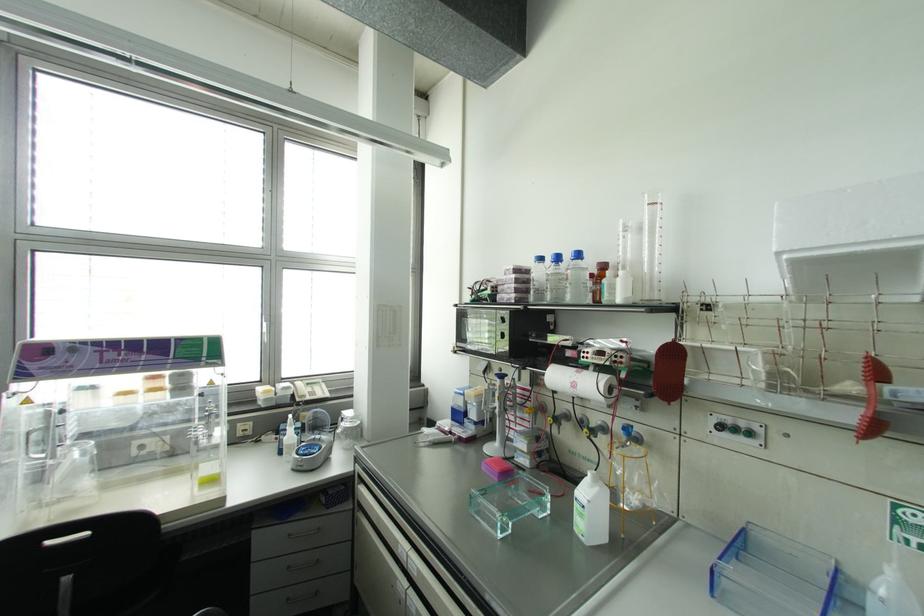
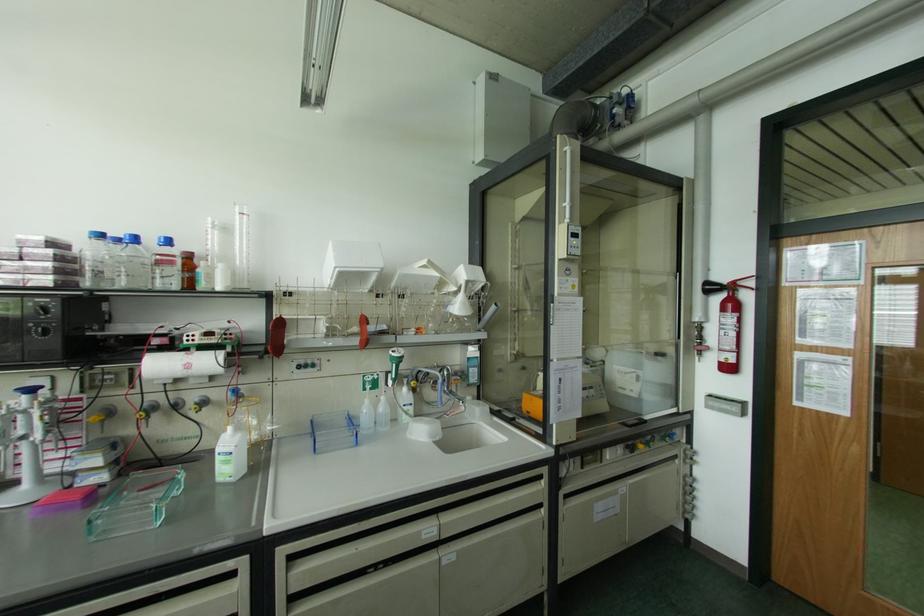
Where in the second image is the point corresponding to (x=596, y=488) from the first image?

(238, 435)